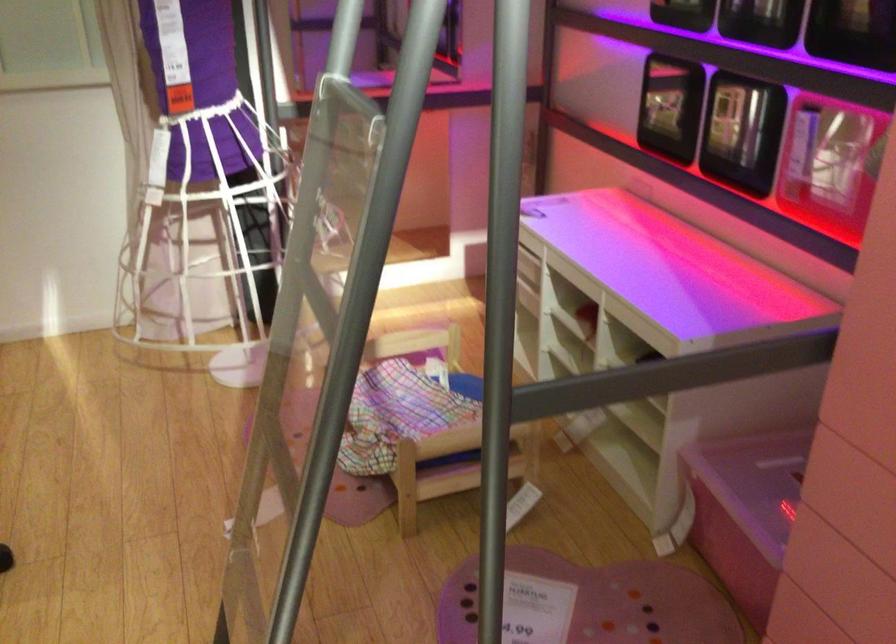
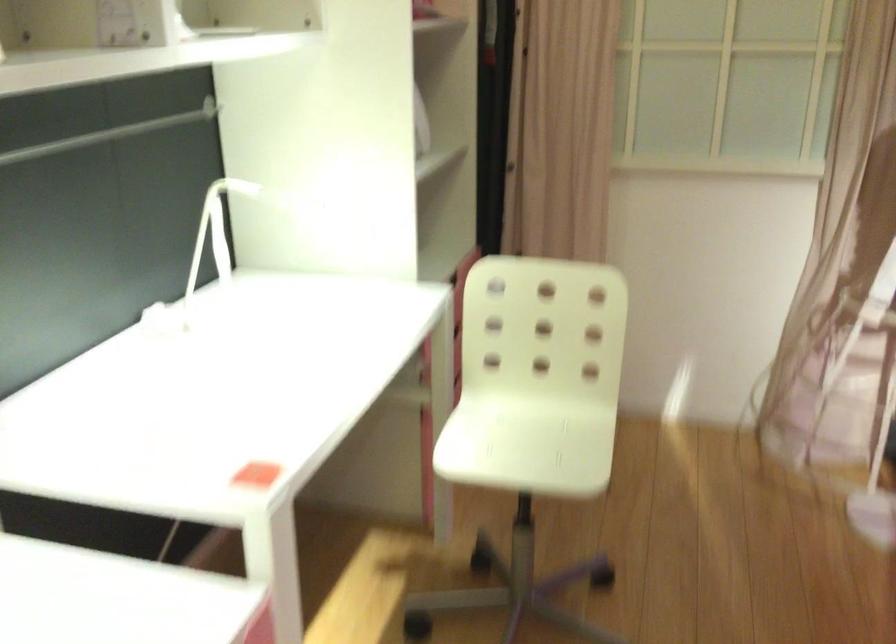
Question: The images are taken continuously from a first-person perspective. In which direction is your viewpoint rotating?

Choices:
 (A) Left
 (B) Right
 (C) Up
 (D) Down

Answer: (A)